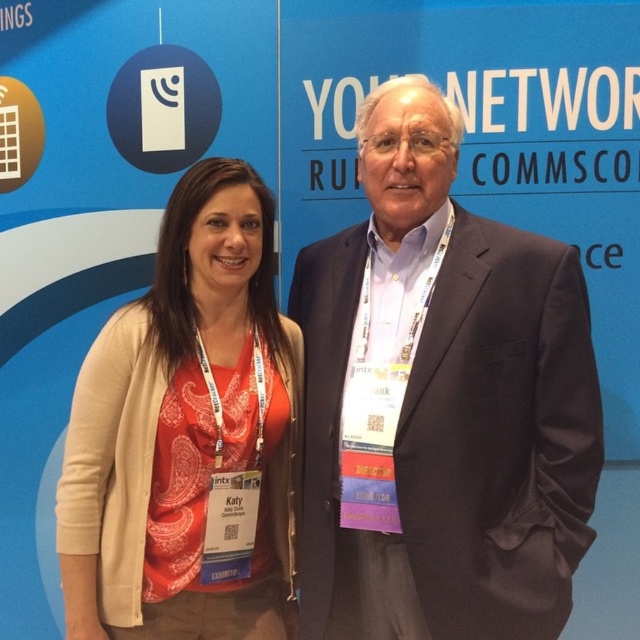
Question: Is satin black suit at center in front of matte orange shirt at center?

Choices:
 (A) no
 (B) yes

Answer: (B)

Question: Can you confirm if satin black suit at center is smaller than matte orange shirt at center?

Choices:
 (A) no
 (B) yes

Answer: (A)

Question: Which object appears closest to the camera in this image?

Choices:
 (A) matte orange shirt at center
 (B) satin black suit at center

Answer: (B)

Question: Which point appears closest to the camera in this image?

Choices:
 (A) (280, 620)
 (B) (308, 577)

Answer: (B)

Question: Considering the relative positions of satin black suit at center and matte orange shirt at center in the image provided, where is satin black suit at center located with respect to matte orange shirt at center?

Choices:
 (A) right
 (B) left

Answer: (A)

Question: Which object appears closest to the camera in this image?

Choices:
 (A) matte orange shirt at center
 (B) satin black suit at center

Answer: (B)